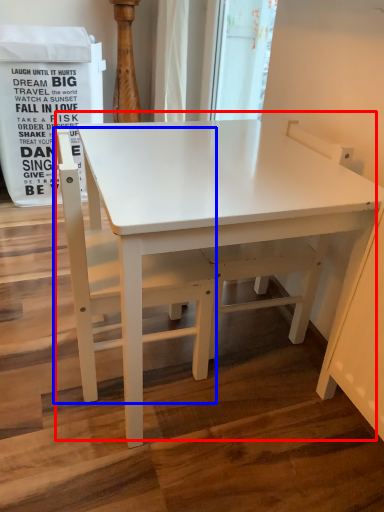
Question: Among these objects, which one is nearest to the camera, table (highlighted by a red box) or chair (highlighted by a blue box)?

Choices:
 (A) table
 (B) chair

Answer: (A)